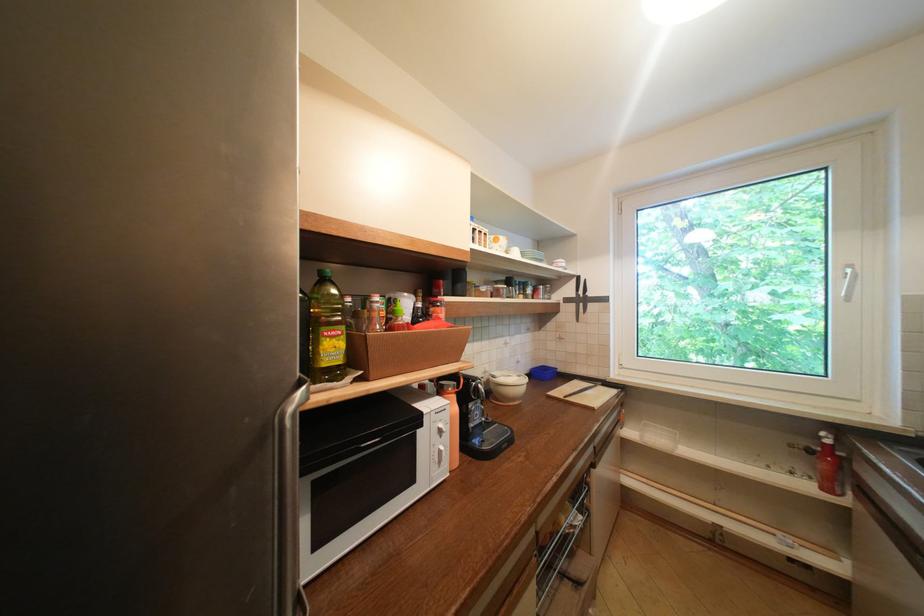
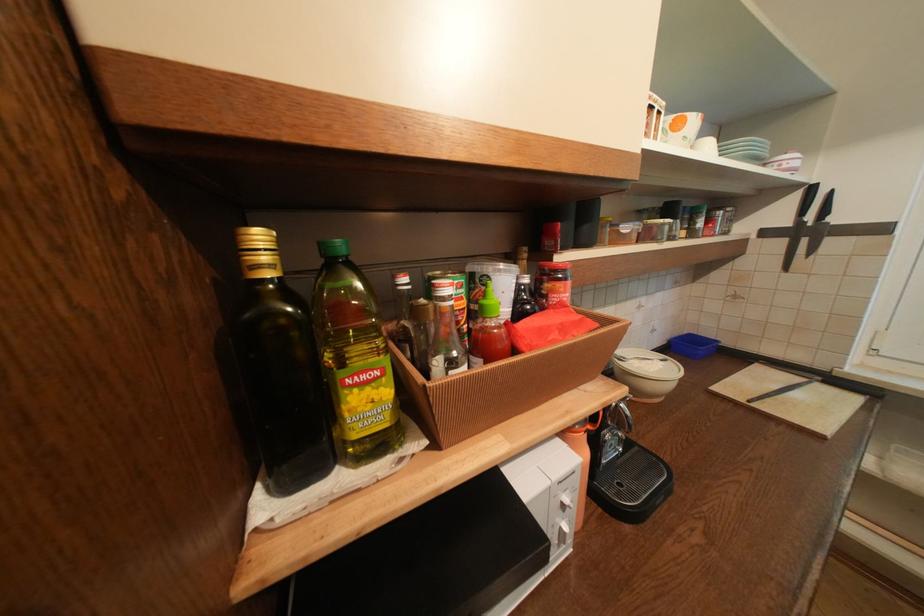
Find the pixel in the second image that matches (345,334) in the first image.

(379, 377)